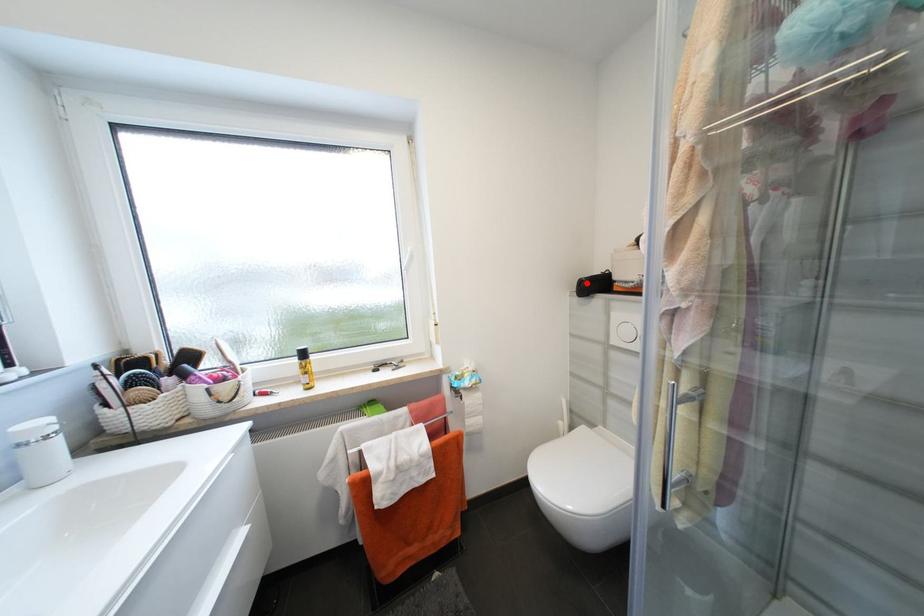
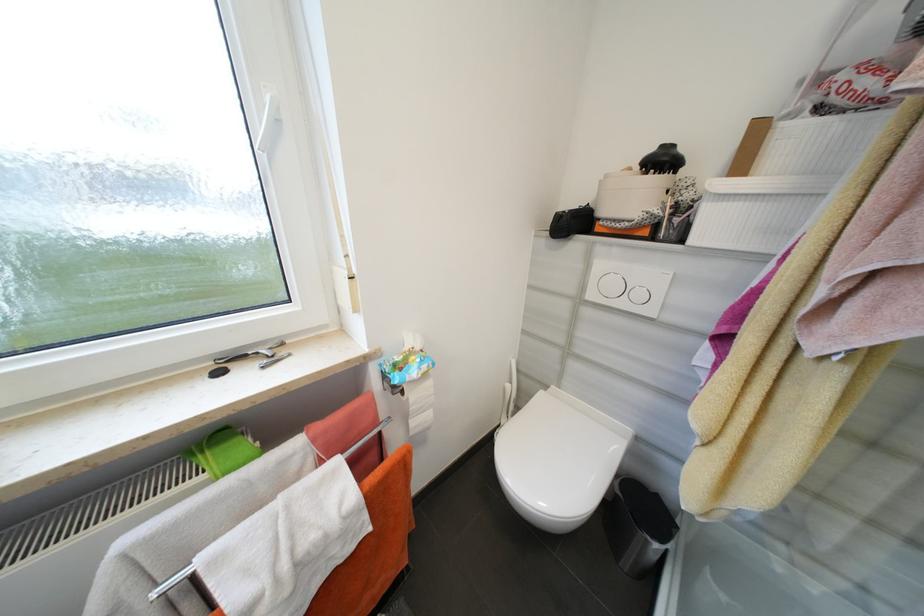
In the second image, find the point that corresponds to the highlighted location in the first image.

(565, 217)